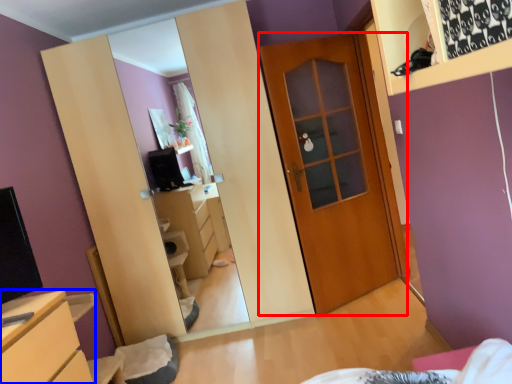
Question: Which point is further to the camera, door (highlighted by a red box) or chest of drawers (highlighted by a blue box)?

Choices:
 (A) door
 (B) chest of drawers

Answer: (A)